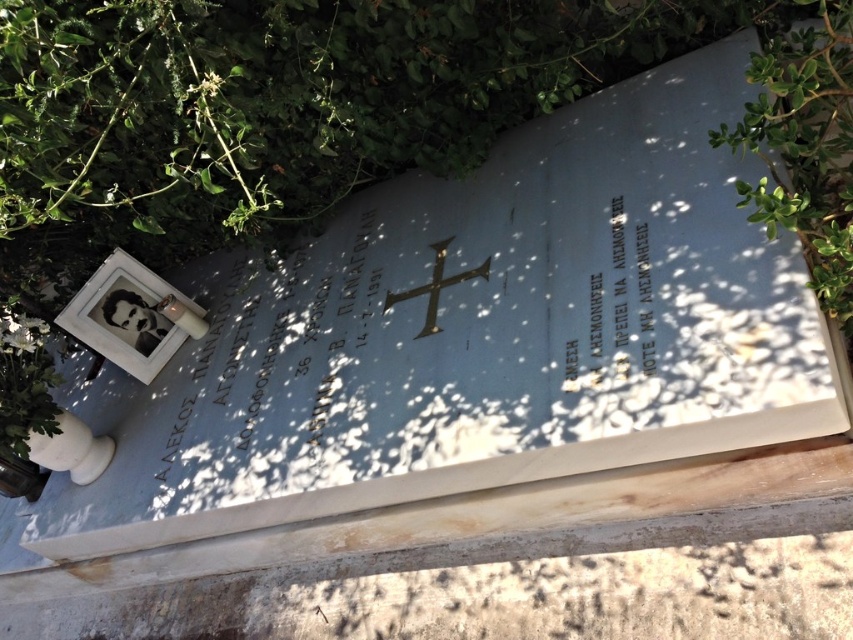
Question: Which object appears closest to the camera in this image?

Choices:
 (A) metallic gold cross at center
 (B) black paper at upper right
 (C) green leafy bush at upper right

Answer: (C)

Question: Considering the real-world distances, which object is closest to the green leafy bush at upper left?

Choices:
 (A) green leafy bush at upper right
 (B) black paper at upper right
 (C) metallic gold cross at center

Answer: (C)

Question: Where is green leafy bush at upper left located in relation to metallic gold cross at center in the image?

Choices:
 (A) above
 (B) below

Answer: (A)

Question: Which object is positioned farthest from the black paper at upper right?

Choices:
 (A) green leafy bush at upper right
 (B) metallic gold cross at center

Answer: (B)

Question: Can you confirm if green leafy bush at upper left is smaller than metallic gold cross at center?

Choices:
 (A) no
 (B) yes

Answer: (A)

Question: Observing the image, what is the correct spatial positioning of green leafy bush at upper right in reference to black paper at upper right?

Choices:
 (A) right
 (B) left

Answer: (A)